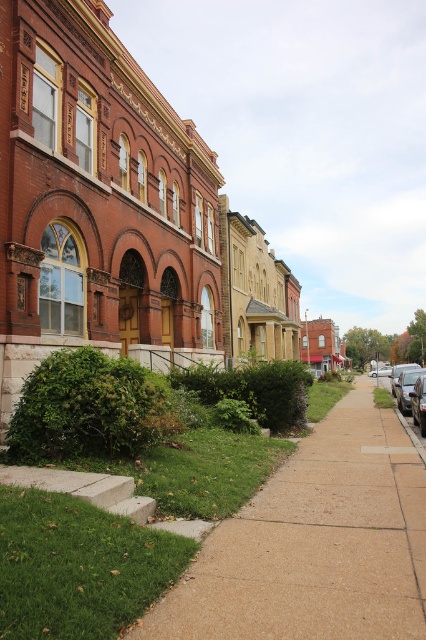
Consider the image. You are standing on the sidewalk in front of the historic brick buildings. You notice two points marked on the ground at coordinates point (417, 384) and point (371, 374). Which point is closer to you?

Point (417, 384) is in front of point (371, 374), so it is closer to you.